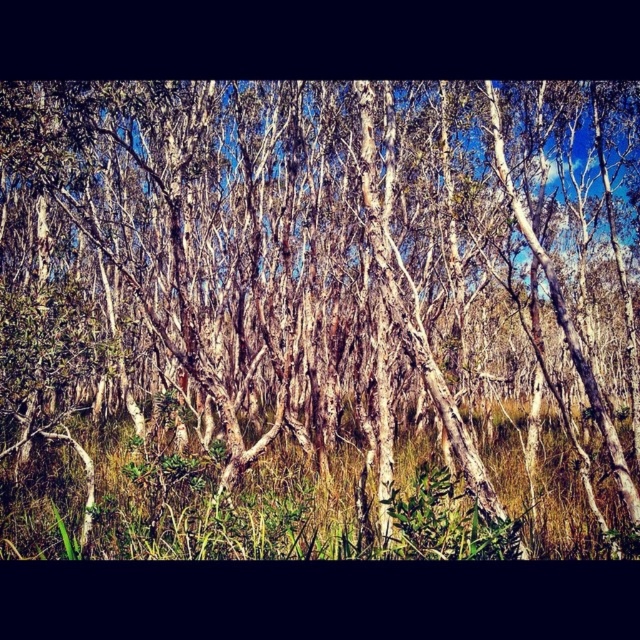
Looking at this image, who is more distant from viewer, (x=374, y=394) or (x=339, y=509)?

Positioned behind is point (x=374, y=394).

Image resolution: width=640 pixels, height=640 pixels. In order to click on white bark trees at center in this screenshot , I will do `click(310, 289)`.

The height and width of the screenshot is (640, 640). Identify the location of white bark trees at center. (310, 289).